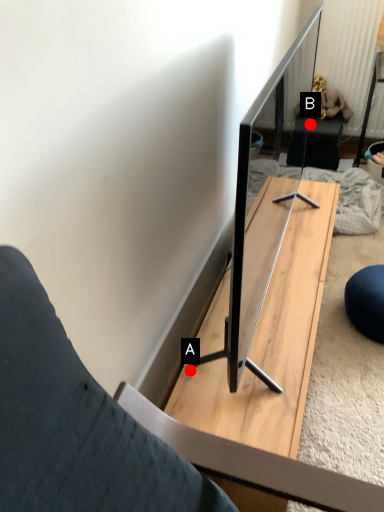
Question: Two points are circled on the image, labeled by A and B beside each circle. Which point is further to the camera?

Choices:
 (A) A is further
 (B) B is further

Answer: (B)